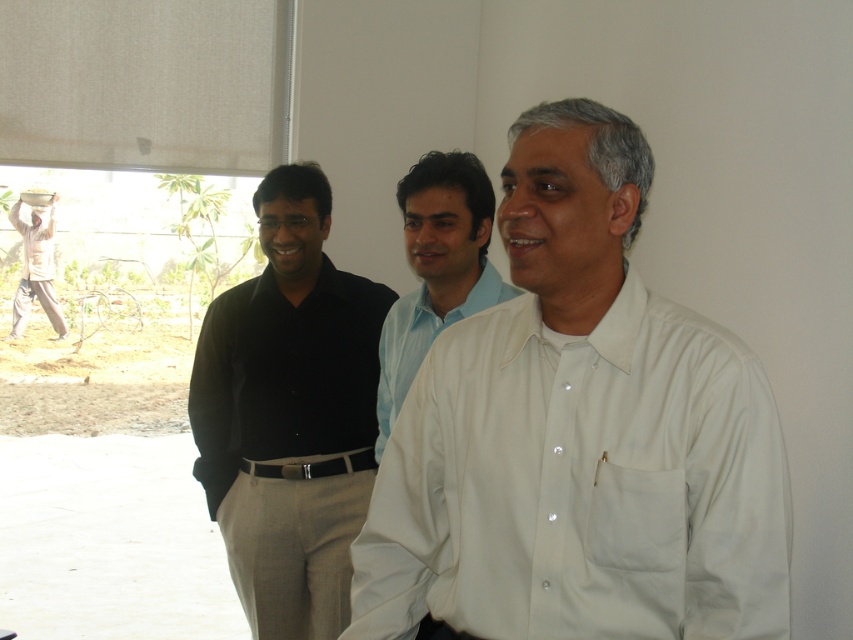
Question: Which object is closer to the camera taking this photo?

Choices:
 (A) light beige cotton shirt at left
 (B) black smooth shirt at center
 (C) white smooth shirt at center
 (D) light blue cotton shirt at center

Answer: (C)

Question: Does black smooth shirt at center appear on the right side of light blue cotton shirt at center?

Choices:
 (A) yes
 (B) no

Answer: (B)

Question: Which point is farther to the camera?

Choices:
 (A) light blue cotton shirt at center
 (B) light beige cotton shirt at left

Answer: (B)

Question: Is light blue cotton shirt at center behind light beige cotton shirt at left?

Choices:
 (A) yes
 (B) no

Answer: (B)

Question: Which object is the closest to the light blue cotton shirt at center?

Choices:
 (A) light beige cotton shirt at left
 (B) black smooth shirt at center
 (C) white smooth shirt at center

Answer: (B)

Question: Can you confirm if black smooth shirt at center is wider than light blue cotton shirt at center?

Choices:
 (A) no
 (B) yes

Answer: (B)